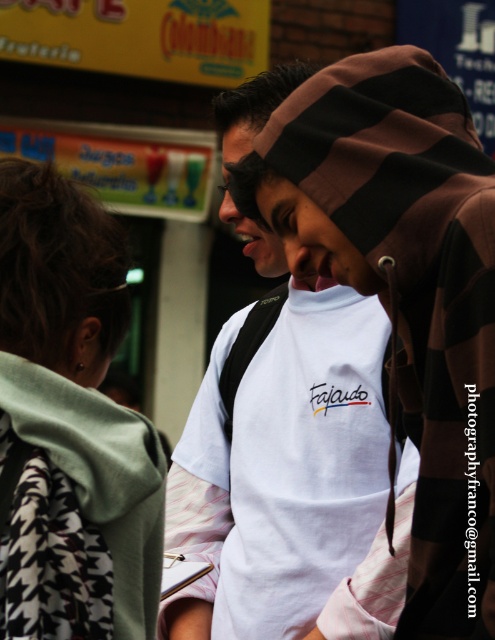
Question: Can you confirm if white cotton t-shirt at center is bigger than green houndstooth scarf at left?

Choices:
 (A) no
 (B) yes

Answer: (A)

Question: Which object appears farthest from the camera in this image?

Choices:
 (A) white cotton t-shirt at center
 (B) green houndstooth scarf at left
 (C) matte black face at center
 (D) white matte t-shirt at center

Answer: (C)

Question: Among these points, which one is farthest from the camera?

Choices:
 (A) (292, 637)
 (B) (243, 230)
 (C) (316, 259)
 (D) (132, 512)

Answer: (B)

Question: Is the position of white matte t-shirt at center less distant than that of matte black face at center?

Choices:
 (A) no
 (B) yes

Answer: (B)

Question: Which point is closer to the camera?

Choices:
 (A) (281, 368)
 (B) (234, 124)
 (C) (11, 577)
 (D) (299, 234)

Answer: (C)

Question: Does white matte t-shirt at center appear under matte black face at center?

Choices:
 (A) no
 (B) yes

Answer: (B)